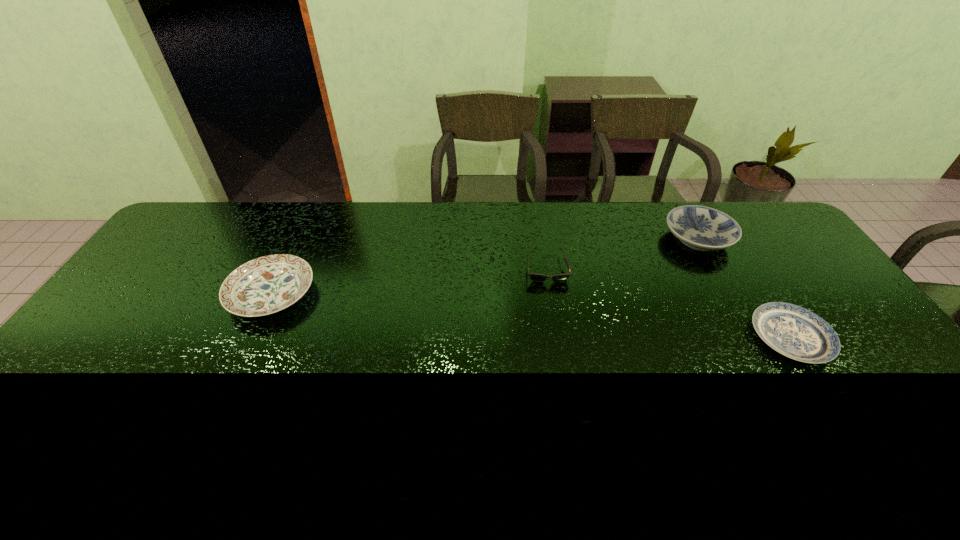
At what (x,y) coordinates should I click in order to perform the action: click on the tallest plate. Please return your answer as a coordinate pair (x, y). Looking at the image, I should click on (701, 228).

Image resolution: width=960 pixels, height=540 pixels. I want to click on the farthest plate, so click(x=701, y=228).

Locate an element on the screen. Image resolution: width=960 pixels, height=540 pixels. the leftmost plate is located at coordinates (265, 285).

The width and height of the screenshot is (960, 540). I want to click on the second shortest plate, so click(x=265, y=285).

The height and width of the screenshot is (540, 960). In order to click on sunglasses in this screenshot , I will do `click(535, 277)`.

Image resolution: width=960 pixels, height=540 pixels. I want to click on the shortest plate, so click(x=795, y=332).

Where is `vacant space situated on the front of the tallest object`? The width and height of the screenshot is (960, 540). vacant space situated on the front of the tallest object is located at coordinates (748, 328).

What are the coordinates of `vacant space located on the front of the leftmost object` in the screenshot? It's located at (x=216, y=412).

The image size is (960, 540). I want to click on vacant region located 0.270m on the front-facing side of the sunglasses, so click(x=561, y=357).

At what (x,y) coordinates should I click in order to perform the action: click on free space located on the back of the shortest object. Please return your answer as a coordinate pair (x, y). The height and width of the screenshot is (540, 960). Looking at the image, I should click on (744, 265).